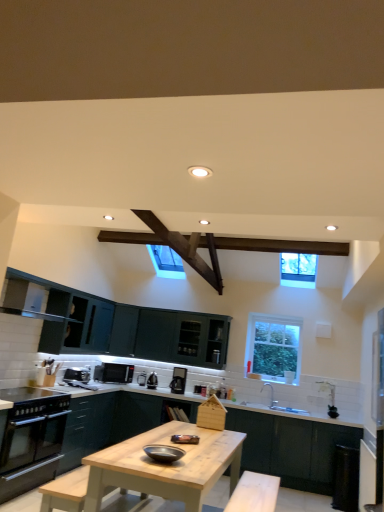
What do you see at coordinates (152, 381) in the screenshot? This screenshot has height=512, width=384. I see `satin black kettle at center, marked as the first appliance in a back-to-front arrangement` at bounding box center [152, 381].

What is the approximate width of satin black kettle at center, marked as the first appliance in a back-to-front arrangement?

7.78 inches.

The image size is (384, 512). Describe the element at coordinates (178, 380) in the screenshot. I see `satin black toaster at center, placed as the 5th appliance when sorted from left to right` at that location.

The image size is (384, 512). I want to click on dark green matte cabinet at lower center, positioned as the second cabinetry in left-to-right order, so click(291, 448).

This screenshot has height=512, width=384. What do you see at coordinates (134, 415) in the screenshot?
I see `matte dark green cabinet at center, arranged as the second cabinetry when viewed from the right` at bounding box center [134, 415].

The height and width of the screenshot is (512, 384). Describe the element at coordinates (298, 270) in the screenshot. I see `clear glass window at upper center, placed as the 1th window when sorted from top to bottom` at that location.

This screenshot has height=512, width=384. Identify the location of satin black kettle at center, the fifth appliance viewed from the front. (152, 381).

Considering the points (2, 484) and (301, 411), which point is in front, point (2, 484) or point (301, 411)?

The point (2, 484) is closer.

Considering the relative sizes of black glass oven at lower left and white ceramic sink at lower center in the image provided, is black glass oven at lower left smaller than white ceramic sink at lower center?

Incorrect, black glass oven at lower left is not smaller in size than white ceramic sink at lower center.

Which object is further away from the camera, black glass oven at lower left or white ceramic sink at lower center?

white ceramic sink at lower center is further away from the camera.

Based on the photo, can you confirm if black glass oven at lower left is positioned to the right of white ceramic sink at lower center?

Incorrect, black glass oven at lower left is not on the right side of white ceramic sink at lower center.

From the image's perspective, who appears lower, light wood table at center or dark wood beam at upper center?

light wood table at center, from the image's perspective.

Is light wood table at center directly adjacent to dark wood beam at upper center?

light wood table at center is not next to dark wood beam at upper center, and they're not touching.

From a real-world perspective, is light wood table at center below dark wood beam at upper center?

Yes, from a real-world perspective, light wood table at center is under dark wood beam at upper center.

Is shiny metallic bowl at center, the 4th appliance when ordered from left to right, positioned with its back to black glass oven at lower left?

No, black glass oven at lower left is not at the back of shiny metallic bowl at center, the 4th appliance when ordered from left to right.

Are shiny metallic bowl at center, the 5th appliance in the back-to-front sequence, and black glass oven at lower left making contact?

shiny metallic bowl at center, the 5th appliance in the back-to-front sequence, and black glass oven at lower left are not in contact.

From a real-world perspective, is shiny metallic bowl at center, the 2th appliance in the right-to-left sequence, under black glass oven at lower left?

No.

Between shiny metallic bowl at center, the 2th appliance in the right-to-left sequence, and black glass oven at lower left, which one is positioned in front?

shiny metallic bowl at center, the 2th appliance in the right-to-left sequence.

From a real-world perspective, which cabinetry is the 1st one underneath the black plastic toaster at lower left, the 1th appliance from the left? Please provide its 2D coordinates.

[(134, 415)]

Which is behind, point (132, 422) or point (79, 368)?

The point (132, 422) is farther from the camera.

Based on the photo, is matte dark green cabinet at center, arranged as the second cabinetry when viewed from the right, facing towards black plastic toaster at lower left, the 1th appliance from the left?

No, matte dark green cabinet at center, arranged as the second cabinetry when viewed from the right, does not turn towards black plastic toaster at lower left, the 1th appliance from the left.

From the image's perspective, would you say matte dark green cabinet at center, arranged as the second cabinetry when viewed from the right, is shown under black plastic toaster at lower left, the fifth appliance in the right-to-left sequence?

Correct, matte dark green cabinet at center, arranged as the second cabinetry when viewed from the right, appears lower than black plastic toaster at lower left, the fifth appliance in the right-to-left sequence, in the image.

Starting from the matte dark green cabinet at center, acting as the first cabinetry starting from the left, which appliance is the 1st one to the left? Please provide its 2D coordinates.

[(114, 373)]

Considering the sizes of matte dark green cabinet at center, acting as the first cabinetry starting from the left, and matte black microwave at center, the second appliance when ordered from left to right, in the image, is matte dark green cabinet at center, acting as the first cabinetry starting from the left, wider or thinner than matte black microwave at center, the second appliance when ordered from left to right,?

matte dark green cabinet at center, acting as the first cabinetry starting from the left, is wider than matte black microwave at center, the second appliance when ordered from left to right.

Is matte black microwave at center, the second appliance from the back, at the back of matte dark green cabinet at center, acting as the first cabinetry starting from the left?

No, matte dark green cabinet at center, acting as the first cabinetry starting from the left, is not facing away from matte black microwave at center, the second appliance from the back.

From the image's perspective, between matte dark green cabinet at center, acting as the first cabinetry starting from the left, and matte black microwave at center, the second appliance when ordered from left to right, which one is located above?

matte black microwave at center, the second appliance when ordered from left to right.

Is white ceramic sink at lower center positioned with its back to clear glass window at upper right, which is the 1th window in back-to-front order?

No, white ceramic sink at lower center is not facing the opposite direction of clear glass window at upper right, which is the 1th window in back-to-front order.

Based on the photo, considering the relative sizes of white ceramic sink at lower center and clear glass window at upper right, which is the 1th window in back-to-front order, in the image provided, is white ceramic sink at lower center wider than clear glass window at upper right, which is the 1th window in back-to-front order,?

Indeed, white ceramic sink at lower center has a greater width compared to clear glass window at upper right, which is the 1th window in back-to-front order.

Can we say white ceramic sink at lower center lies outside clear glass window at upper right, which is the 1th window in back-to-front order?

Absolutely, white ceramic sink at lower center is external to clear glass window at upper right, which is the 1th window in back-to-front order.

Does point (288, 407) lie in front of point (263, 362)?

Yes.

From the image's perspective, who appears lower, light wood table at center or black plastic toaster at lower left, arranged as the 4th appliance when viewed from the back?

light wood table at center.

Relative to black plastic toaster at lower left, marked as the second appliance in a front-to-back arrangement, is light wood table at center in front or behind?

light wood table at center is in front of black plastic toaster at lower left, marked as the second appliance in a front-to-back arrangement.

Is light wood table at center positioned far away from black plastic toaster at lower left, the fifth appliance in the right-to-left sequence?

light wood table at center is positioned a significant distance from black plastic toaster at lower left, the fifth appliance in the right-to-left sequence.

This screenshot has height=512, width=384. Identify the location of sink that is behind the black glass oven at lower left. (281, 406).

Locate an element on the screen. Image resolution: width=384 pixels, height=512 pixels. table located below the dark wood beam at upper center (from the image's perspective) is located at coordinates (166, 466).

When comparing their distances from clear glass window at upper right, marked as the second window in a top-to-bottom arrangement, does satin black kettle at center, the third appliance when ordered from left to right, or satin black toaster at center, placed as the 5th appliance when sorted from left to right, seem further?

Among the two, satin black kettle at center, the third appliance when ordered from left to right, is located further to clear glass window at upper right, marked as the second window in a top-to-bottom arrangement.

Which object lies further to the anchor point shiny metallic bowl at center, the 2th appliance in the right-to-left sequence, black glass oven at lower left or dark green matte cabinet at lower center, positioned as the second cabinetry in left-to-right order?

dark green matte cabinet at lower center, positioned as the second cabinetry in left-to-right order, lies further to shiny metallic bowl at center, the 2th appliance in the right-to-left sequence, than the other object.

Considering their positions, is matte black microwave at center, which is the 4th appliance in right-to-left order, positioned further to black glass oven at lower left than dark green matte cabinet at lower center, which is counted as the 1th cabinetry, starting from the right?

dark green matte cabinet at lower center, which is counted as the 1th cabinetry, starting from the right, is positioned further to the anchor black glass oven at lower left.

Based on the photo, which object lies further to the anchor point dark green matte cabinet at lower center, positioned as the second cabinetry in left-to-right order, matte dark green cabinet at center, arranged as the second cabinetry when viewed from the right, or clear glass window at upper right, which is the 1th window in back-to-front order?

Among the two, matte dark green cabinet at center, arranged as the second cabinetry when viewed from the right, is located further to dark green matte cabinet at lower center, positioned as the second cabinetry in left-to-right order.

From the image, which object appears to be farther from black glass oven at lower left, clear glass window at upper center, placed as the 2th window when sorted from bottom to top, or shiny metallic bowl at center, the first appliance viewed from the front?

clear glass window at upper center, placed as the 2th window when sorted from bottom to top, is further to black glass oven at lower left.

From the image, which object appears to be nearer to shiny metallic bowl at center, the 4th appliance when ordered from left to right, matte dark green cabinet at center, arranged as the second cabinetry when viewed from the right, or satin black kettle at center, the fifth appliance viewed from the front?

Among the two, matte dark green cabinet at center, arranged as the second cabinetry when viewed from the right, is located nearer to shiny metallic bowl at center, the 4th appliance when ordered from left to right.

Considering their positions, is satin black toaster at center, which appears as the 3th appliance when viewed from the front, positioned further to clear glass window at upper right, the first window when ordered from bottom to top, than matte black microwave at center, positioned as the 4th appliance in front-to-back order?

matte black microwave at center, positioned as the 4th appliance in front-to-back order, is further to clear glass window at upper right, the first window when ordered from bottom to top.

Based on the photo, from the image, which object appears to be farther from white ceramic sink at lower center, clear glass window at upper center, placed as the 1th window when sorted from top to bottom, or shiny metallic bowl at center, the 5th appliance in the back-to-front sequence?

shiny metallic bowl at center, the 5th appliance in the back-to-front sequence, is positioned further to the anchor white ceramic sink at lower center.

Locate an element on the screen. The image size is (384, 512). exhaust hood situated between black glass oven at lower left and clear glass window at upper center, placed as the 2th window when sorted from bottom to top, from left to right is located at coordinates (187, 248).

Image resolution: width=384 pixels, height=512 pixels. I want to click on sink between shiny metallic bowl at center, the 2th appliance in the right-to-left sequence, and satin black kettle at center, the third appliance when ordered from left to right, in the front-back direction, so click(281, 406).

The height and width of the screenshot is (512, 384). In order to click on sink between light wood table at center and black plastic toaster at lower left, the 1th appliance from the left, in the front-back direction in this screenshot , I will do `click(281, 406)`.

Where is `appliance between satin black toaster at center, arranged as the 3th appliance when viewed from the back, and matte dark green cabinet at center, acting as the first cabinetry starting from the left, in the up-down direction`? This screenshot has height=512, width=384. appliance between satin black toaster at center, arranged as the 3th appliance when viewed from the back, and matte dark green cabinet at center, acting as the first cabinetry starting from the left, in the up-down direction is located at coordinates (152, 381).